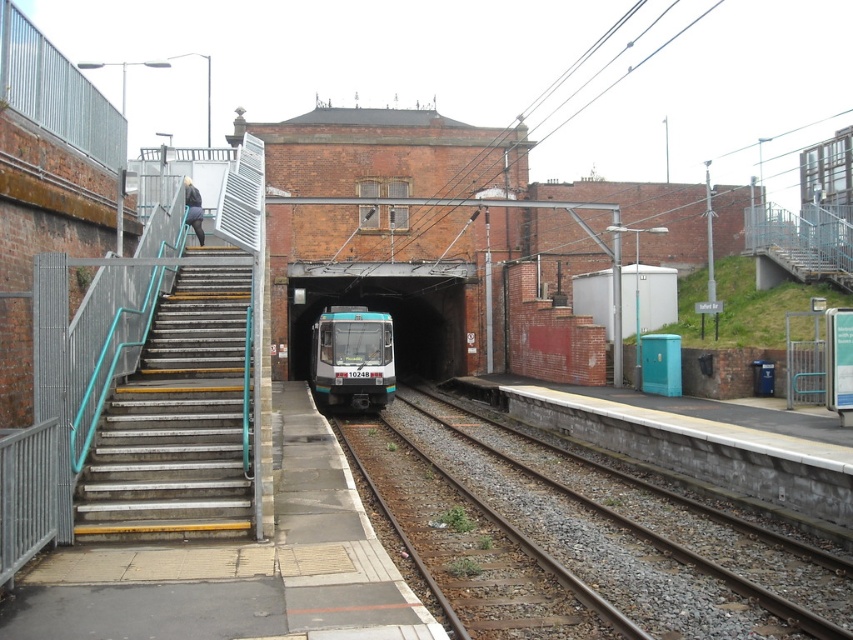
At what (x,y) coordinates should I click in order to perform the action: click on metal/stainless steel stairs at left. Please return your answer as a coordinate pair (x, y). Looking at the image, I should click on (177, 422).

Is metal/stainless steel stairs at left to the right of teal glass train at center from the viewer's perspective?

In fact, metal/stainless steel stairs at left is to the left of teal glass train at center.

Is point (242, 381) positioned in front of point (314, 285)?

Yes.

Locate an element on the screen. The image size is (853, 640). metal/stainless steel stairs at left is located at coordinates (177, 422).

Where is `smooth concrete tracks at center`? The height and width of the screenshot is (640, 853). smooth concrete tracks at center is located at coordinates pos(579,541).

Which is in front, point (836, 588) or point (207, 534)?

Point (207, 534) is in front.

Is point (752, 556) less distant than point (160, 332)?

Yes, it is.

Locate an element on the screen. This screenshot has height=640, width=853. smooth concrete tracks at center is located at coordinates (579, 541).

Can you confirm if teal glass train at center is positioned to the right of teal glossy train at center?

Yes, teal glass train at center is to the right of teal glossy train at center.

Measure the distance between teal glass train at center and camera.

teal glass train at center and camera are 32.30 meters apart.

Where is `teal glass train at center`? teal glass train at center is located at coordinates (386, 308).